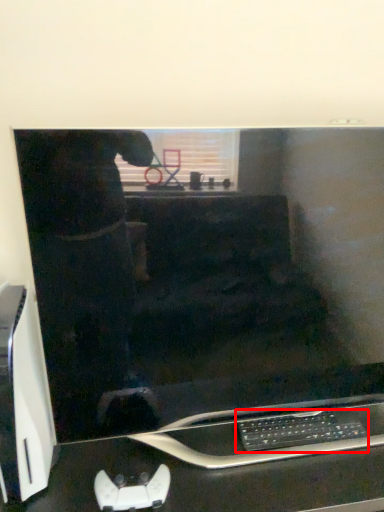
Question: From the image, what is the correct spatial relationship of computer keyboard (annotated by the red box) in relation to computer desk?

Choices:
 (A) right
 (B) left

Answer: (A)